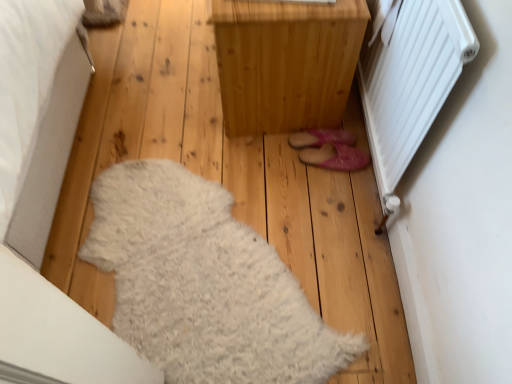
You are a GUI agent. You are given a task and a screenshot of the screen. Output one action in this format:
    pyautogui.click(x=<x>, y=<y>)
    Task: Click on the free location above white fluffy rug at lower left (from a real-world perspective)
    The image size is (512, 384).
    Given the screenshot: What is the action you would take?
    pyautogui.click(x=218, y=260)